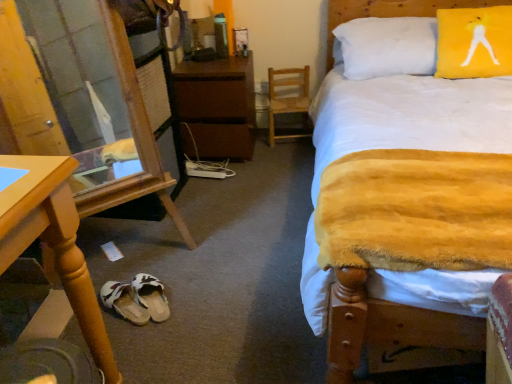
Question: Does white fabric slipper at lower center, which appears as the first footwear when viewed from the right, have a greater height compared to wooden desk at lower left?

Choices:
 (A) no
 (B) yes

Answer: (A)

Question: Is white fabric slipper at lower center, which appears as the first footwear when viewed from the right, far away from wooden desk at lower left?

Choices:
 (A) yes
 (B) no

Answer: (B)

Question: Is white fabric slipper at lower center, the 2th footwear in the left-to-right sequence, directly adjacent to wooden desk at lower left?

Choices:
 (A) no
 (B) yes

Answer: (A)

Question: Considering the relative sizes of white fabric slipper at lower center, the 2th footwear in the left-to-right sequence, and wooden desk at lower left in the image provided, is white fabric slipper at lower center, the 2th footwear in the left-to-right sequence, shorter than wooden desk at lower left?

Choices:
 (A) no
 (B) yes

Answer: (B)

Question: Is white fabric slipper at lower center, the 2th footwear in the left-to-right sequence, oriented towards wooden desk at lower left?

Choices:
 (A) no
 (B) yes

Answer: (A)

Question: From the image's perspective, is yellow plush blanket at center positioned above or below brown matte nightstand at center?

Choices:
 (A) below
 (B) above

Answer: (A)

Question: In the image, is yellow plush blanket at center positioned in front of or behind brown matte nightstand at center?

Choices:
 (A) front
 (B) behind

Answer: (A)

Question: Looking at their shapes, would you say yellow plush blanket at center is wider or thinner than brown matte nightstand at center?

Choices:
 (A) wide
 (B) thin

Answer: (A)

Question: Considering the positions of yellow plush blanket at center and brown matte nightstand at center in the image, is yellow plush blanket at center bigger or smaller than brown matte nightstand at center?

Choices:
 (A) big
 (B) small

Answer: (A)

Question: From a real-world perspective, is transparent glass door at lower left above or below yellow fabric pillow at upper right?

Choices:
 (A) below
 (B) above

Answer: (A)

Question: Considering their positions, is transparent glass door at lower left located in front of or behind yellow fabric pillow at upper right?

Choices:
 (A) front
 (B) behind

Answer: (A)

Question: In terms of width, does transparent glass door at lower left look wider or thinner when compared to yellow fabric pillow at upper right?

Choices:
 (A) wide
 (B) thin

Answer: (A)

Question: Which is correct: transparent glass door at lower left is inside yellow fabric pillow at upper right, or outside of it?

Choices:
 (A) outside
 (B) inside

Answer: (A)

Question: Does point (453, 49) appear closer or farther from the camera than point (190, 62)?

Choices:
 (A) farther
 (B) closer

Answer: (B)

Question: Is yellow fabric pillow at upper right taller or shorter than brown matte nightstand at center?

Choices:
 (A) short
 (B) tall

Answer: (A)